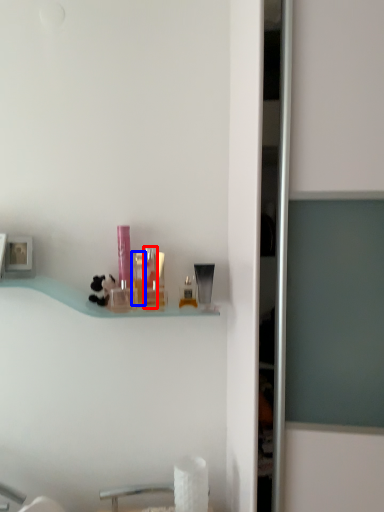
Question: Among these objects, which one is nearest to the camera, toiletry (highlighted by a red box) or toiletry (highlighted by a blue box)?

Choices:
 (A) toiletry
 (B) toiletry

Answer: (B)